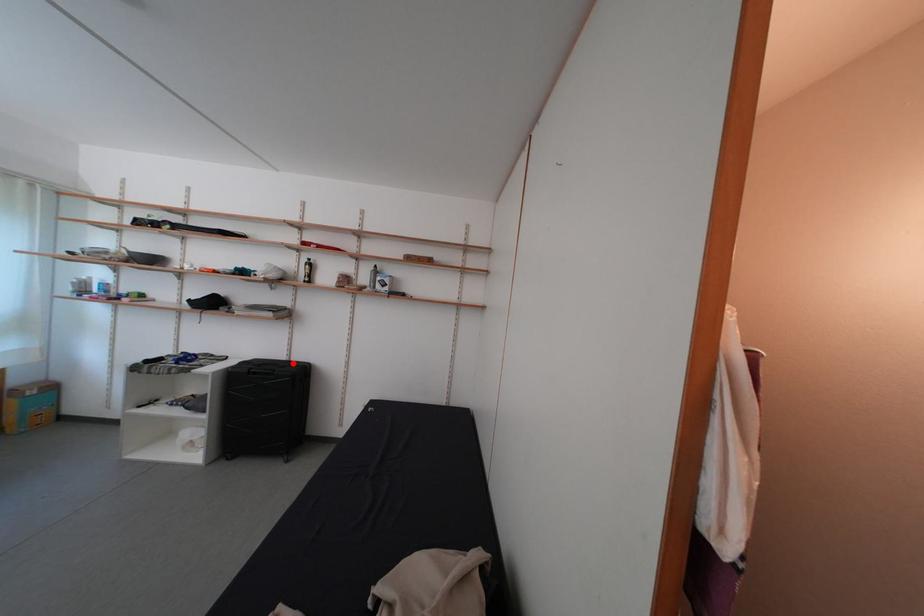
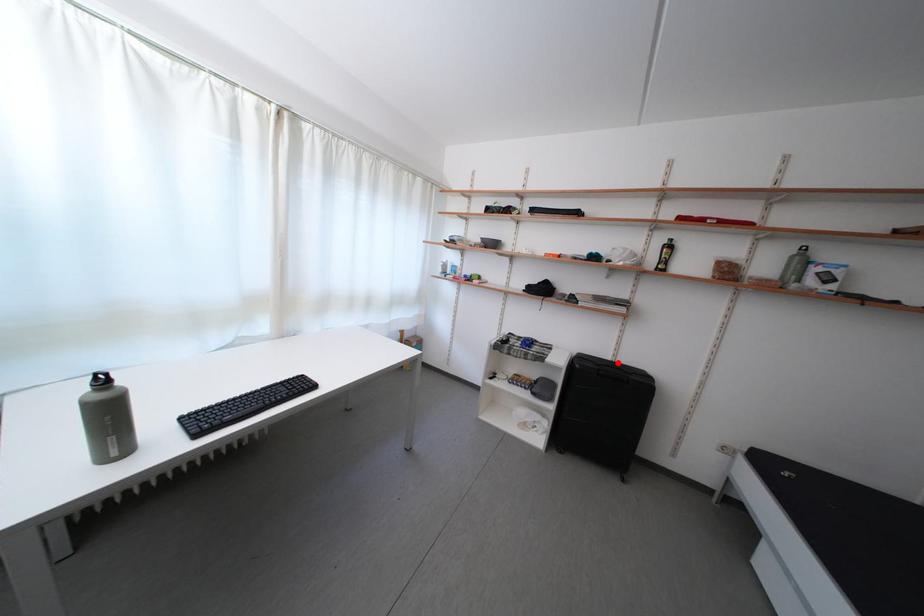
In the scene shown: I am providing you with two images of the same scene from different viewpoints. A red point is marked on the first image and another point is marked on the second image. Is the marked point in image1 the same physical position as the marked point in image2?

Yes